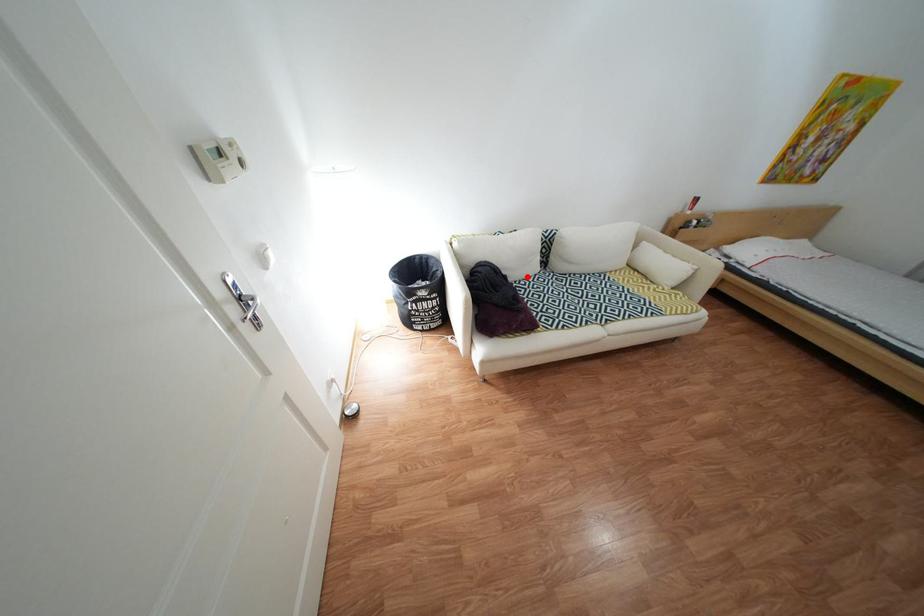
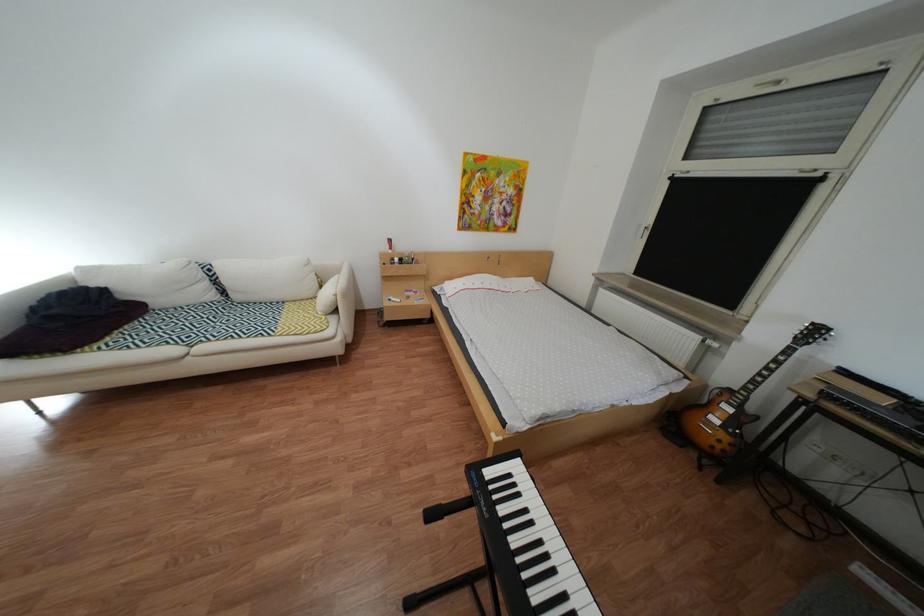
In the second image, find the point that corresponds to the highlighted location in the first image.

(172, 304)